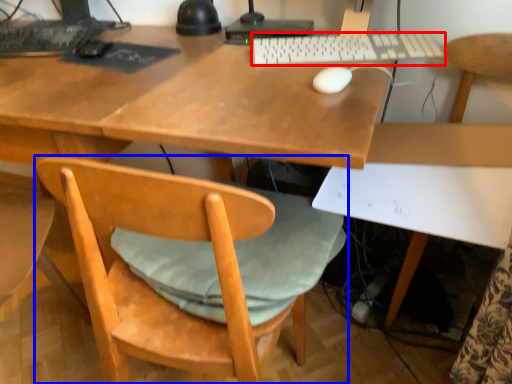
Question: Among these objects, which one is farthest to the camera, computer keyboard (highlighted by a red box) or chair (highlighted by a blue box)?

Choices:
 (A) computer keyboard
 (B) chair

Answer: (A)